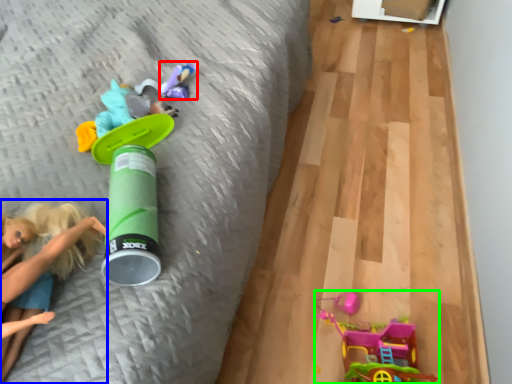
Question: Based on their relative distances, which object is farther from toy (highlighted by a red box)? Choose from person (highlighted by a blue box) and toy (highlighted by a green box).

Choices:
 (A) person
 (B) toy

Answer: (B)